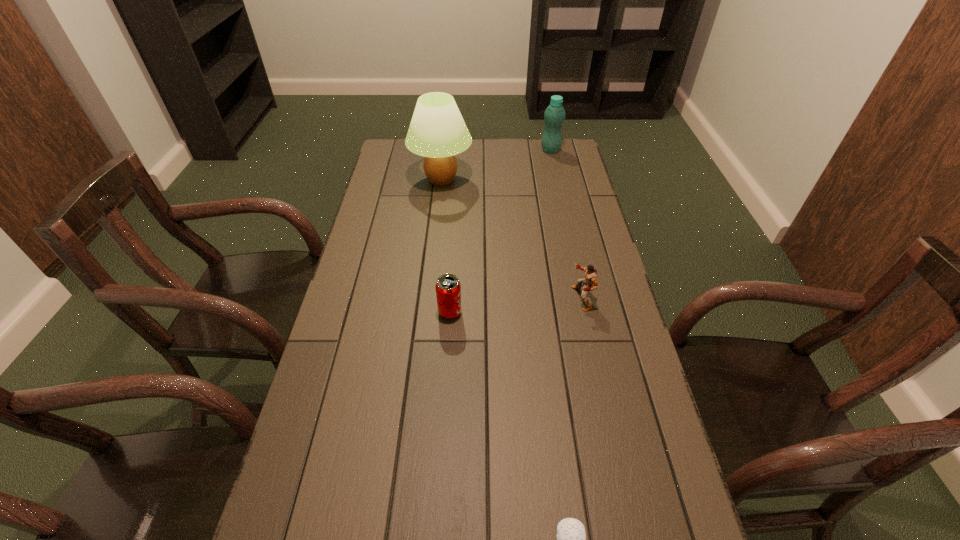
The height and width of the screenshot is (540, 960). I want to click on lampshade, so click(437, 131).

Identify the location of the second farthest object. (437, 131).

Find the location of a particular element. This screenshot has height=540, width=960. the farthest object is located at coordinates (554, 116).

Identify the location of water bottle. (554, 116).

The height and width of the screenshot is (540, 960). I want to click on puncher, so click(x=590, y=278).

In order to click on soda can in this screenshot , I will do `click(448, 288)`.

The height and width of the screenshot is (540, 960). I want to click on free space located on the shade of the second farthest object, so click(528, 180).

The image size is (960, 540). I want to click on free region located at the front cap of the water bottle, so click(x=559, y=186).

Where is `vacant space situated 0.380m on the front-facing side of the puncher`? The image size is (960, 540). vacant space situated 0.380m on the front-facing side of the puncher is located at coordinates (444, 299).

In order to click on vacant area situated 0.120m on the front-facing side of the puncher in this screenshot , I will do `click(532, 299)`.